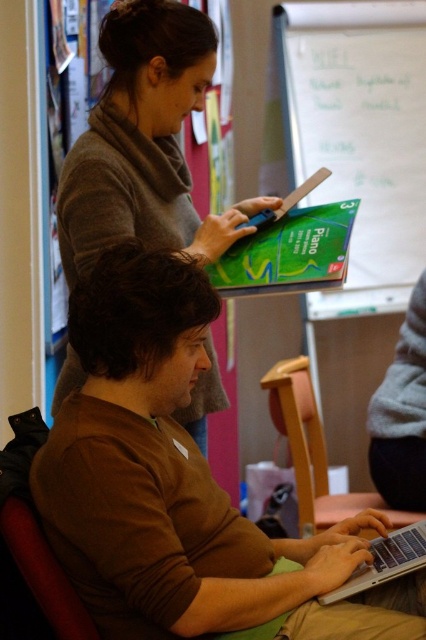
Question: Which of the following is the farthest from the observer?

Choices:
 (A) (126, 429)
 (B) (207, 371)
 (C) (330, 509)
 (D) (377, 576)

Answer: (C)

Question: Does green cardboard box at upper center appear on the left side of matte gray sweater at upper left?

Choices:
 (A) yes
 (B) no

Answer: (B)

Question: Which object is the closest to the green cardboard box at upper center?

Choices:
 (A) matte gray sweater at upper left
 (B) silver metallic laptop at lower center
 (C) brown matte shirt at center

Answer: (A)

Question: Can you confirm if matte gray sweater at upper left is thinner than wooden chair at lower center?

Choices:
 (A) no
 (B) yes

Answer: (A)

Question: Is brown matte shirt at center above silver metallic laptop at lower center?

Choices:
 (A) no
 (B) yes

Answer: (B)

Question: Which object is closer to the camera taking this photo?

Choices:
 (A) brown matte shirt at center
 (B) green cardboard box at upper center

Answer: (A)